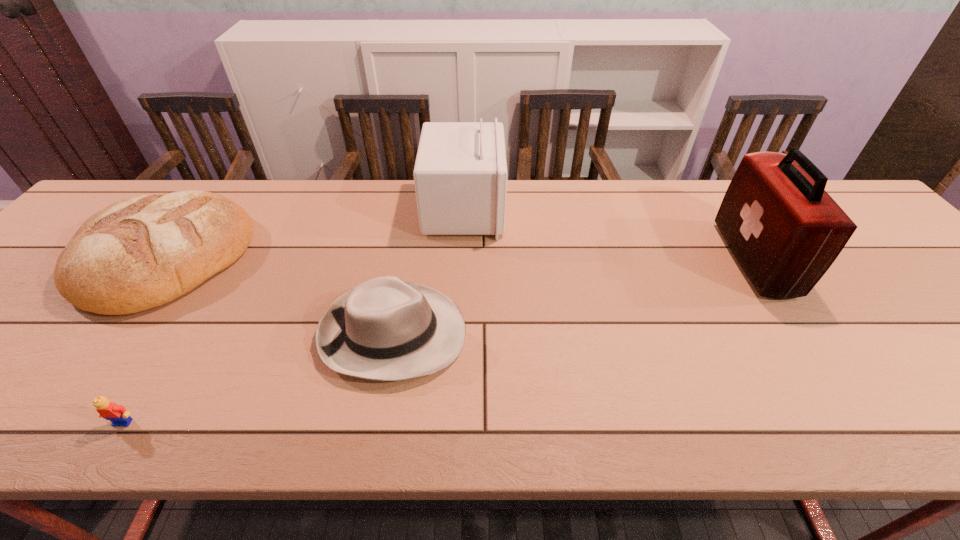
Identify the location of vacant space that's between the left first-aid kit and the rightmost object. (609, 234).

Identify the location of free area in between the shortest object and the fedora. Image resolution: width=960 pixels, height=540 pixels. (258, 378).

You are a GUI agent. You are given a task and a screenshot of the screen. Output one action in this format:
    pyautogui.click(x=<x>, y=<y>)
    Task: Click on the vacant space that's between the fedora and the left first-aid kit
    The image size is (960, 540).
    Given the screenshot: What is the action you would take?
    pyautogui.click(x=428, y=272)

You are a GUI agent. You are given a task and a screenshot of the screen. Output one action in this format:
    pyautogui.click(x=<x>, y=<y>)
    Task: Click on the free spot between the rightmost object and the bread
    The image size is (960, 540).
    Given the screenshot: What is the action you would take?
    pyautogui.click(x=459, y=259)

Where is `vacant space in between the fedora and the left first-aid kit`? vacant space in between the fedora and the left first-aid kit is located at coordinates (428, 272).

This screenshot has height=540, width=960. Find the location of `free space that is in between the bread and the fedora`. free space that is in between the bread and the fedora is located at coordinates (278, 296).

Locate an element on the screen. The image size is (960, 540). unoccupied position between the fedora and the left first-aid kit is located at coordinates (428, 272).

The width and height of the screenshot is (960, 540). Find the location of `object that is the third closest to the left first-aid kit`. object that is the third closest to the left first-aid kit is located at coordinates pyautogui.click(x=785, y=231).

Identify which object is the third nearest to the bread. Please provide its 2D coordinates. Your answer should be formatted as a tuple, i.e. [(x, y)], where the tuple contains the x and y coordinates of a point satisfying the conditions above.

[(460, 175)]

This screenshot has height=540, width=960. I want to click on vacant position in the image that satisfies the following two spatial constraints: 1. on the front-facing side of the left first-aid kit; 2. on the face of the nearest object, so click(455, 422).